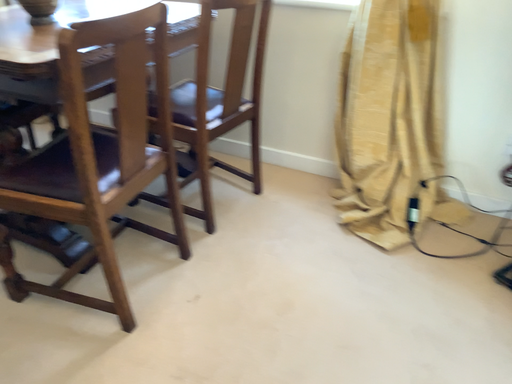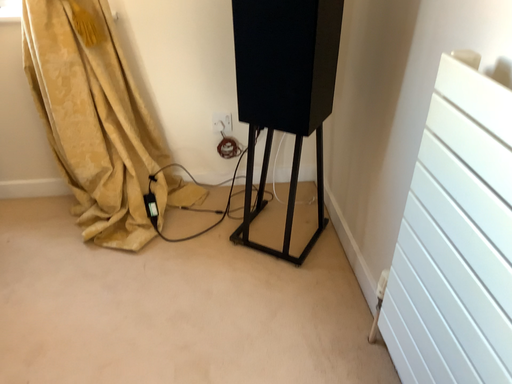
Question: How did the camera likely rotate when shooting the video?

Choices:
 (A) rotated right
 (B) rotated left

Answer: (A)